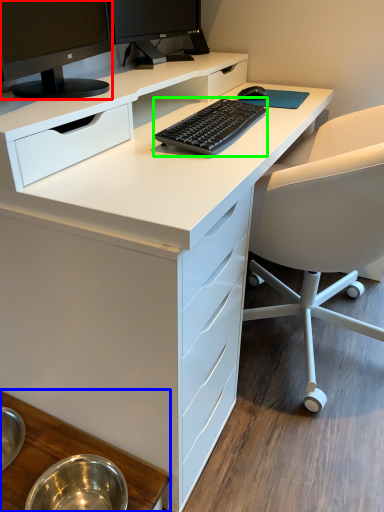
Question: Which object is the closest to the computer monitor (highlighted by a red box)? Choose among these: table (highlighted by a blue box) or computer keyboard (highlighted by a green box).

Choices:
 (A) table
 (B) computer keyboard

Answer: (B)